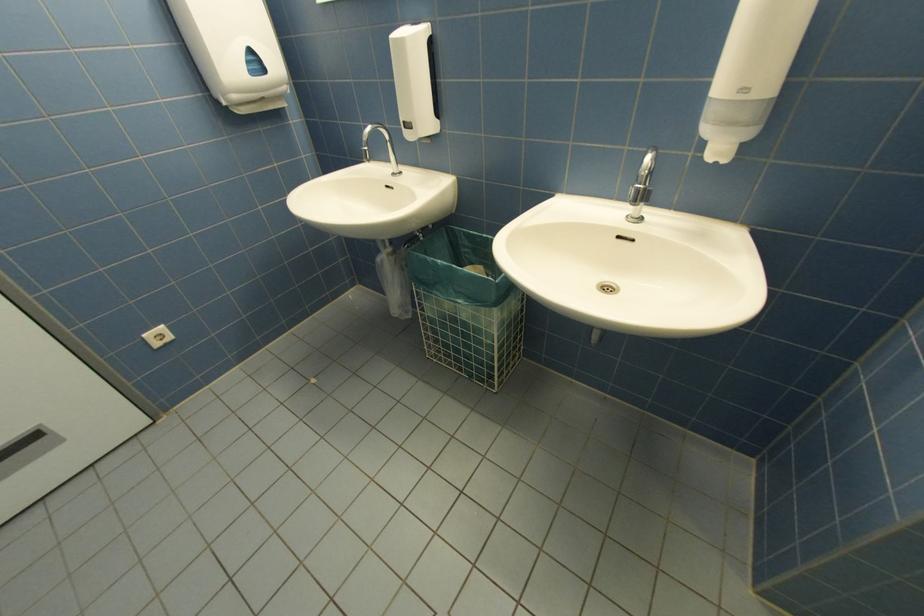
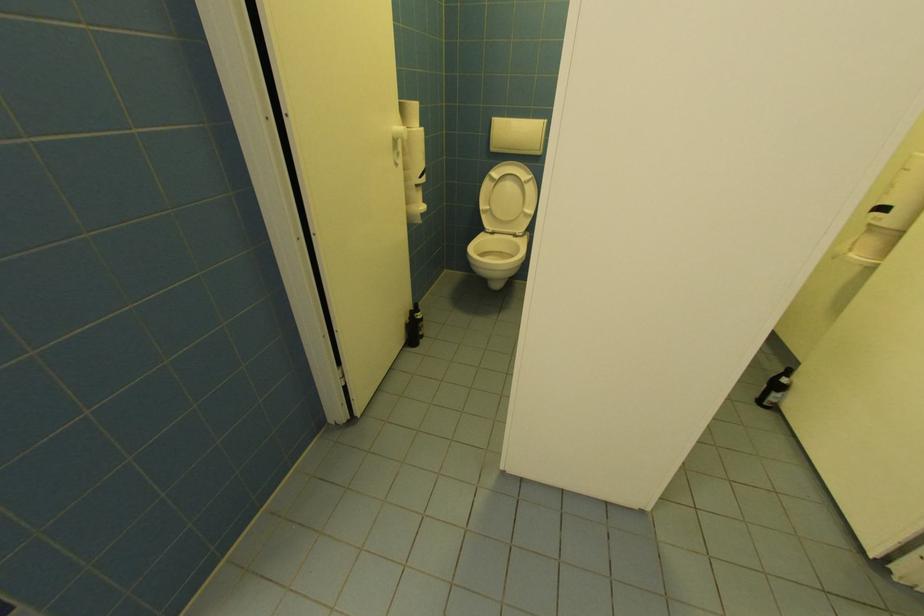
First-person continuous shooting, in which direction is the camera rotating?

The camera's rotation is toward right-down.